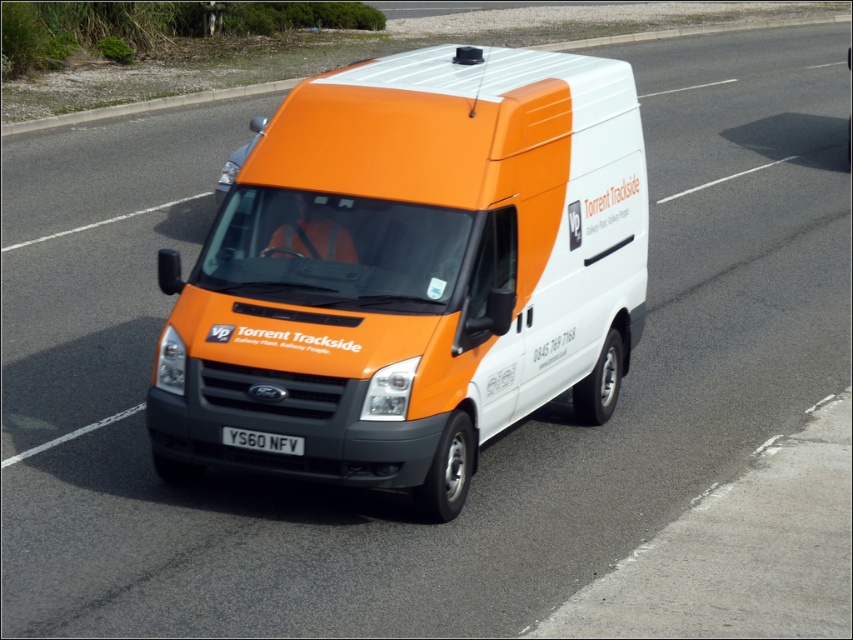
Question: Is orange matte van at center to the right of black metal license plate at center from the viewer's perspective?

Choices:
 (A) yes
 (B) no

Answer: (A)

Question: Among these points, which one is farthest from the camera?

Choices:
 (A) (274, 440)
 (B) (608, 260)

Answer: (B)

Question: Does orange matte van at center appear under black metal license plate at center?

Choices:
 (A) yes
 (B) no

Answer: (B)

Question: Which object appears farthest from the camera in this image?

Choices:
 (A) orange matte van at center
 (B) black metal license plate at center

Answer: (B)

Question: Which point is closer to the camera taking this photo?

Choices:
 (A) (235, 429)
 (B) (393, 131)

Answer: (A)

Question: Can you confirm if orange matte van at center is smaller than black metal license plate at center?

Choices:
 (A) no
 (B) yes

Answer: (A)